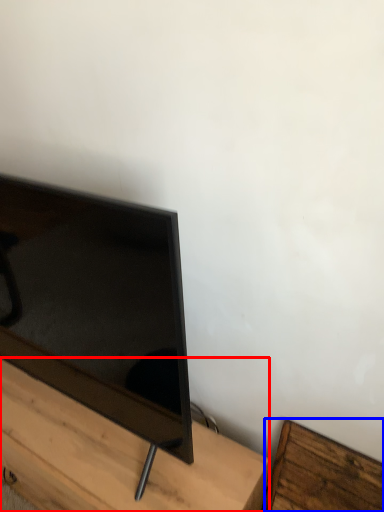
Question: Which point is further to the camera, furniture (highlighted by a red box) or furniture (highlighted by a blue box)?

Choices:
 (A) furniture
 (B) furniture

Answer: (B)